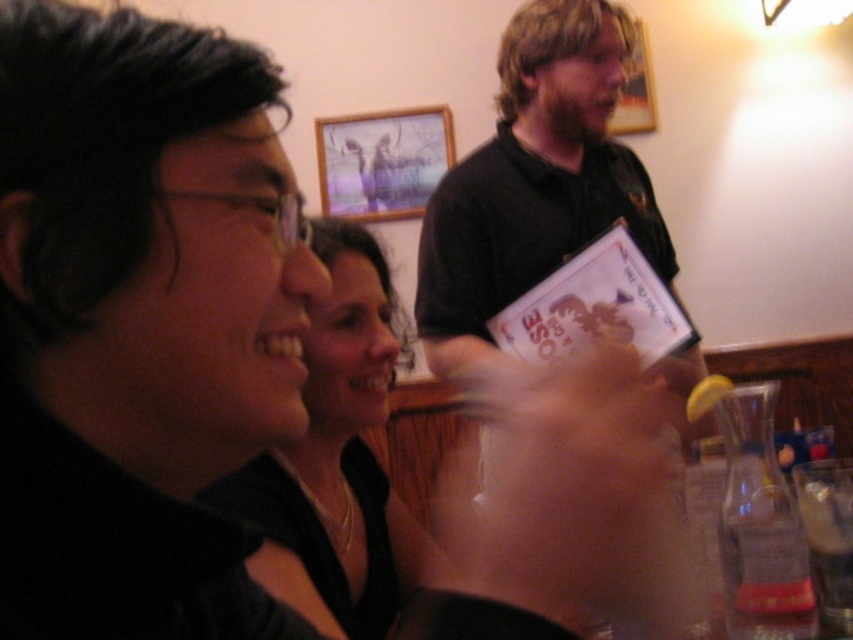
Who is more distant from viewer, [527,179] or [585,257]?

The point [527,179] is more distant.

Does dark brown shirt at center have a smaller size compared to white paper card at center?

No.

Where is `dark brown shirt at center`? Image resolution: width=853 pixels, height=640 pixels. dark brown shirt at center is located at coordinates (532, 186).

Image resolution: width=853 pixels, height=640 pixels. I want to click on dark brown shirt at center, so click(x=532, y=186).

Can you confirm if white paper card at center is positioned below clear glass at lower right?

Incorrect, white paper card at center is not positioned below clear glass at lower right.

Who is more forward, (641, 362) or (838, 614)?

Positioned in front is point (838, 614).

The width and height of the screenshot is (853, 640). Describe the element at coordinates (596, 307) in the screenshot. I see `white paper card at center` at that location.

Find the location of `white paper card at center`. white paper card at center is located at coordinates (596, 307).

Does black matte face at center have a lesser width compared to white paper card at center?

Indeed, black matte face at center has a lesser width compared to white paper card at center.

How much distance is there between black matte face at center and white paper card at center?

The distance of black matte face at center from white paper card at center is 3.31 feet.

Is point (10, 58) positioned in front of point (666, 344)?

Yes.

You are a GUI agent. You are given a task and a screenshot of the screen. Output one action in this format:
    pyautogui.click(x=<x>, y=<y>)
    Task: Click on the black matte face at center
    The height and width of the screenshot is (640, 853).
    Given the screenshot: What is the action you would take?
    point(134,323)